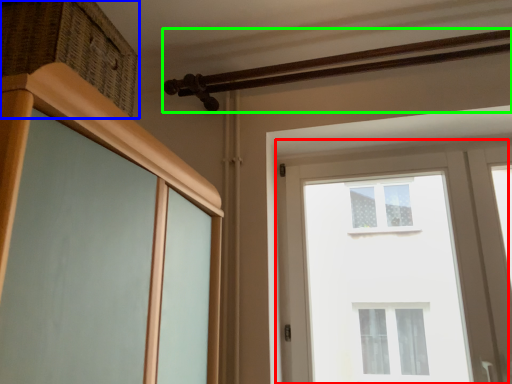
Question: Estimate the real-world distances between objects in this image. Which object is closer to window (highlighted by a red box), drawer (highlighted by a blue box) or rail (highlighted by a green box)?

Choices:
 (A) drawer
 (B) rail

Answer: (B)